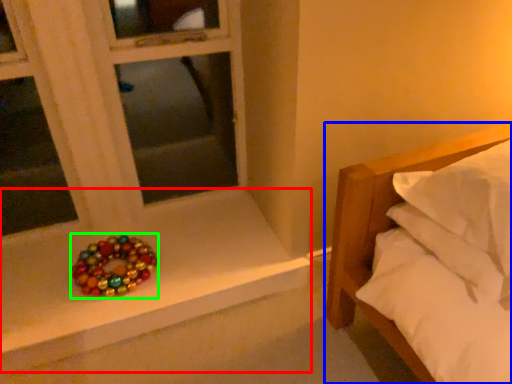
Question: Estimate the real-world distances between objects in this image. Which object is closer to window sill (highlighted by a red box), bed (highlighted by a blue box) or glass bead (highlighted by a green box)?

Choices:
 (A) bed
 (B) glass bead

Answer: (B)